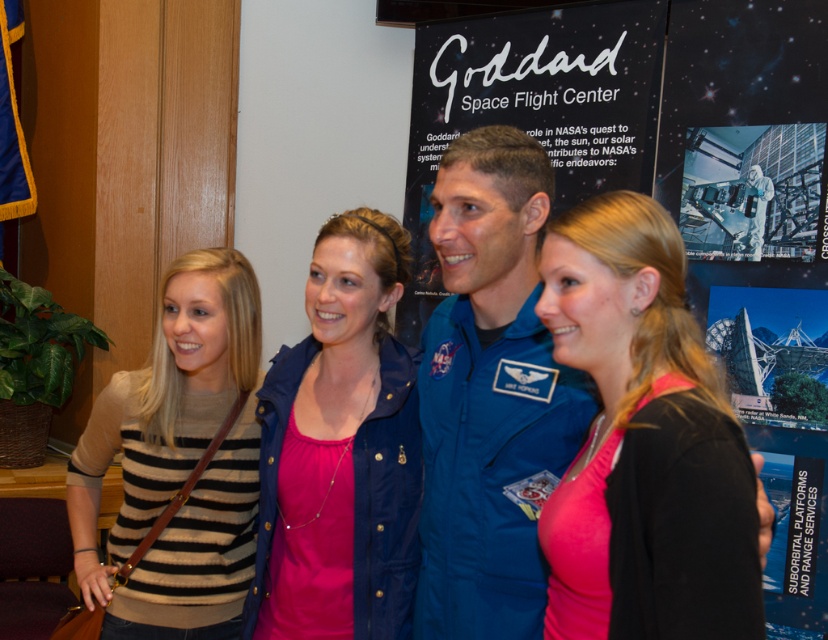
Which of these two, metallic silver satellite at upper right or black matte poster at center, stands taller?

Standing taller between the two is black matte poster at center.

Which is in front, point (715, 198) or point (728, 324)?

Point (728, 324) is more forward.

This screenshot has height=640, width=828. I want to click on metallic silver satellite at upper right, so click(751, 192).

Which is more to the left, navy blue jacket at center or black matte poster at center?

navy blue jacket at center

Which is above, navy blue jacket at center or black matte poster at center?

Positioned higher is black matte poster at center.

Find the location of a particular element. The image size is (828, 640). navy blue jacket at center is located at coordinates (340, 451).

Consider the image. Which is more to the right, blue fabric astronaut suit at center or metallic silver satellite at upper right?

metallic silver satellite at upper right

Which is in front, point (545, 400) or point (793, 140)?

Point (545, 400)

Locate an element on the screen. The height and width of the screenshot is (640, 828). blue fabric astronaut suit at center is located at coordinates (489, 394).